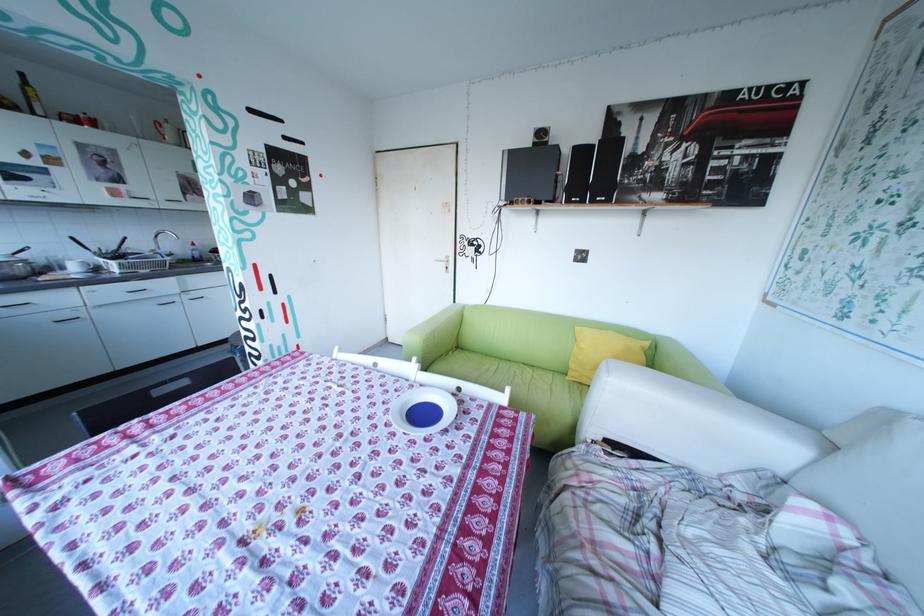
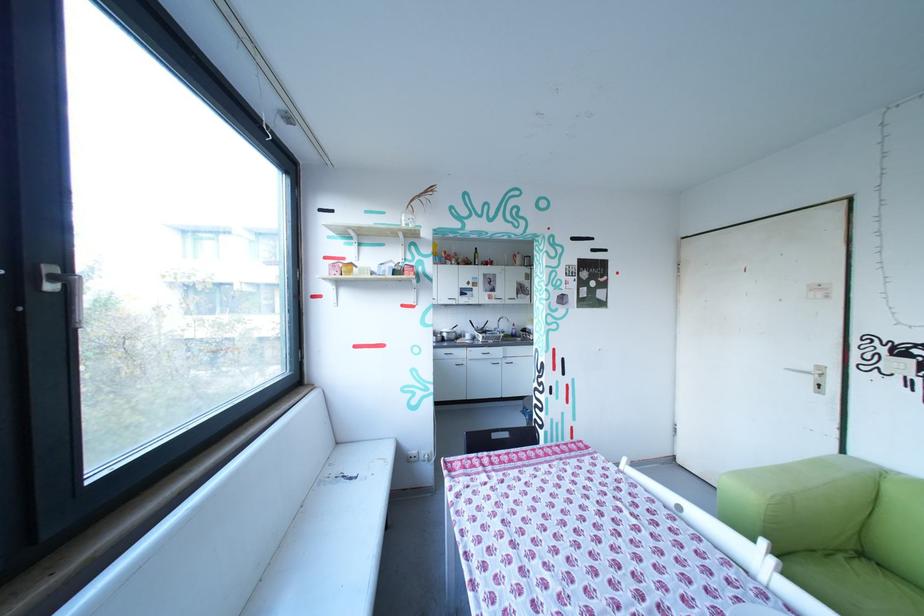
Where in the second image is the point corresponding to the point at 172,392 from the first image?

(507, 436)